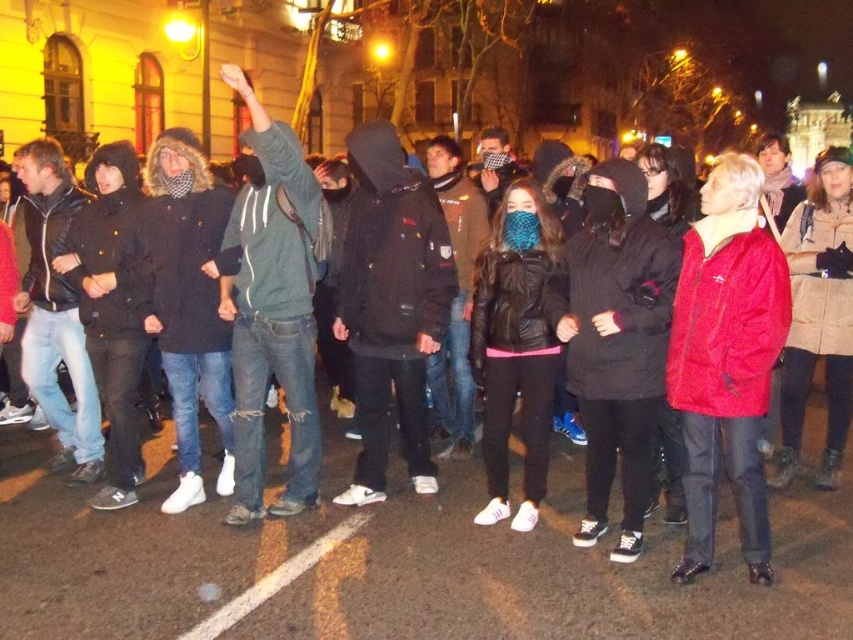
Does point (764, 282) lie in front of point (248, 372)?

Yes, point (764, 282) is in front of point (248, 372).

Image resolution: width=853 pixels, height=640 pixels. I want to click on velvet red jacket at center, so click(x=726, y=358).

Locate an element on the screen. This screenshot has height=640, width=853. velvet red jacket at center is located at coordinates (726, 358).